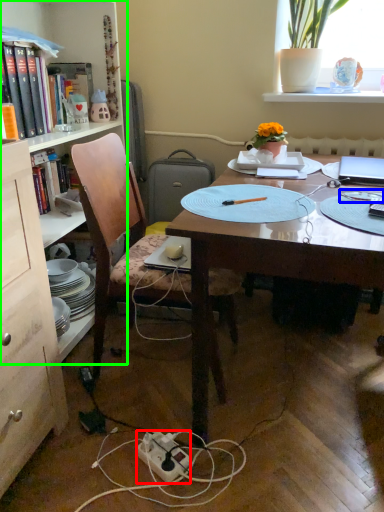
Question: Which is nearer to the power outlet (highlighted by a red box)? tableware (highlighted by a blue box) or bookcase (highlighted by a green box).

Choices:
 (A) tableware
 (B) bookcase

Answer: (A)